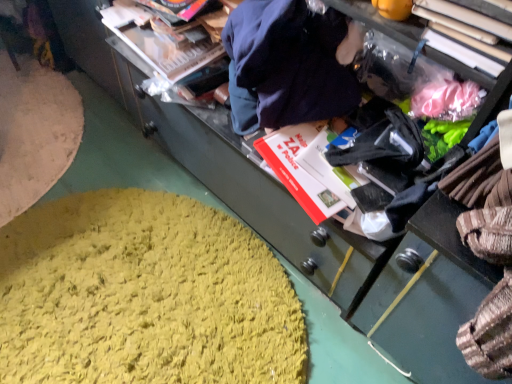
This screenshot has width=512, height=384. What are the coordinates of `empty space that is ontop of yellow shaggy rug at lower left (from a real-world perspective)` in the screenshot? It's located at (154, 286).